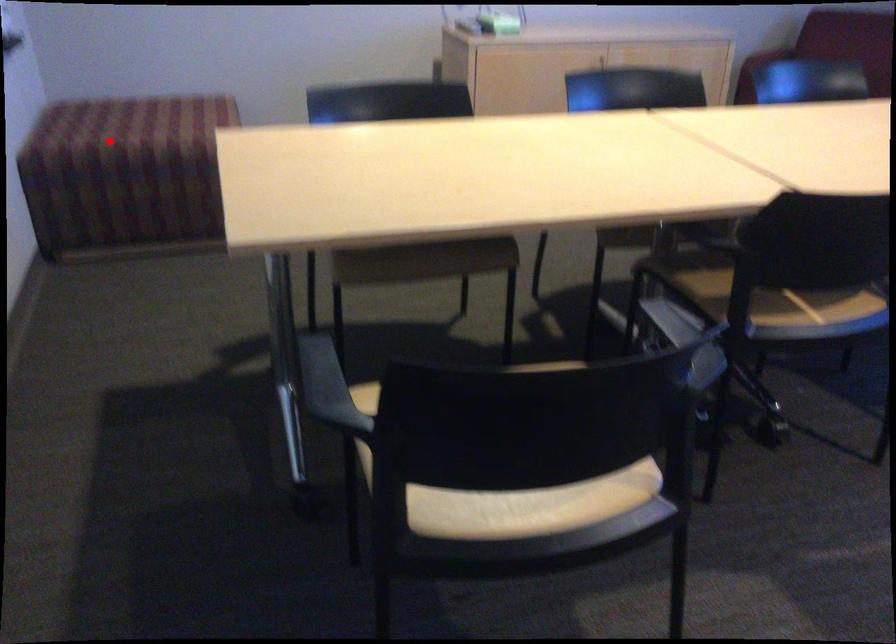
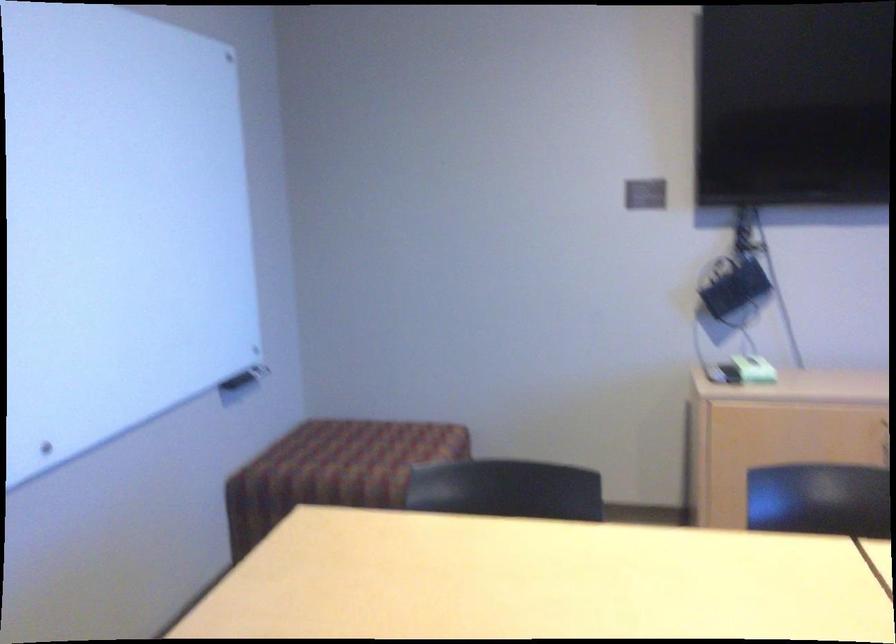
Question: I am providing you with two images of the same scene from different viewpoints. A red point is marked on the first image. At the location where the point appears in image 1, is it still visible in image 2?

Choices:
 (A) Yes
 (B) No

Answer: (A)